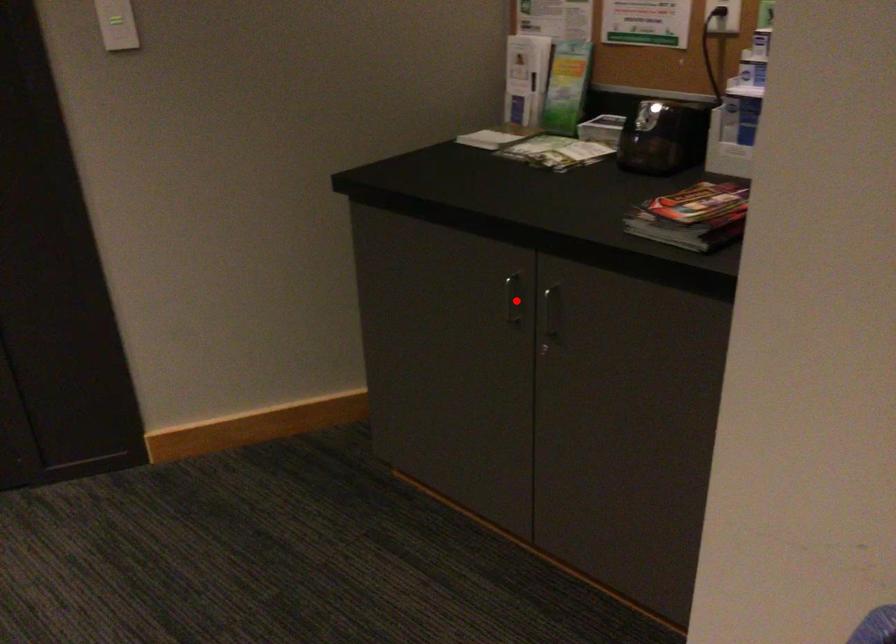
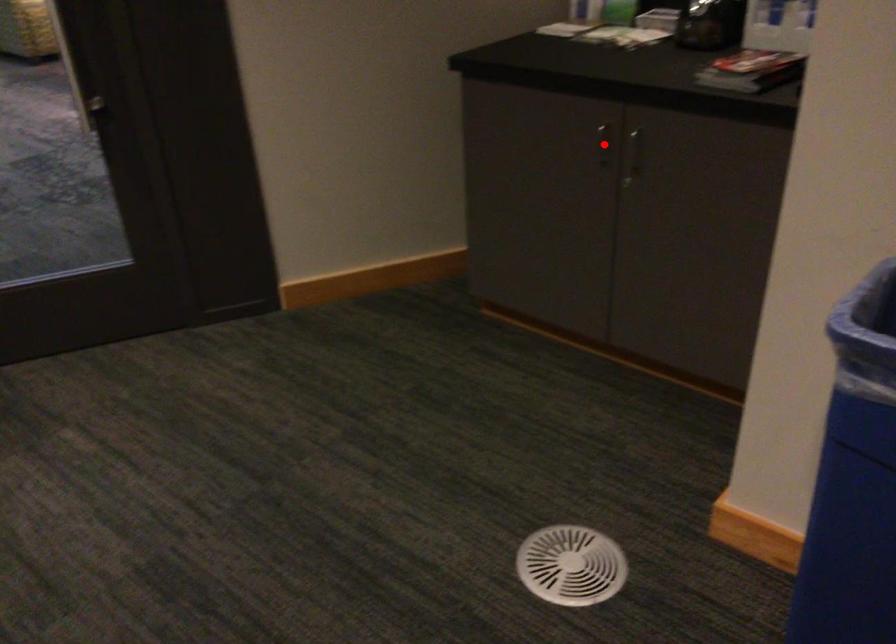
I am providing you with two images of the same scene from different viewpoints. A red point is marked on the first image and another point is marked on the second image. Do the highlighted points in image1 and image2 indicate the same real-world spot?

Yes